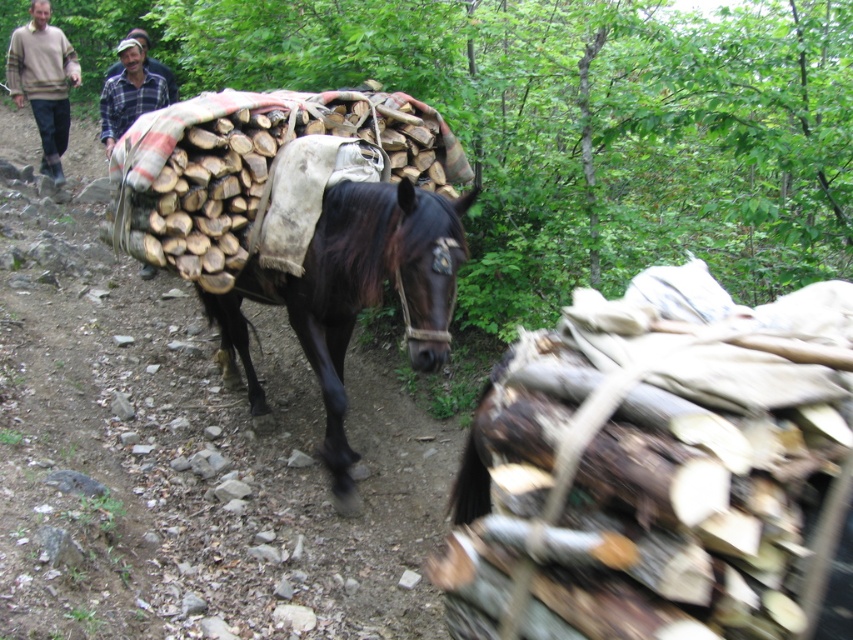
In the scene shown: Can you confirm if shiny dark brown horse at center is positioned below beige sweater at upper left?

Correct, shiny dark brown horse at center is located below beige sweater at upper left.

Does shiny dark brown horse at center have a lesser height compared to beige sweater at upper left?

Indeed, shiny dark brown horse at center has a lesser height compared to beige sweater at upper left.

Is point (338, 506) closer to camera compared to point (67, 44)?

Yes, it is in front of point (67, 44).

Locate an element on the screen. The image size is (853, 640). shiny dark brown horse at center is located at coordinates (349, 291).

Can you confirm if wooden logs at center is positioned to the left of beige sweater at upper left?

In fact, wooden logs at center is to the right of beige sweater at upper left.

Is wooden logs at center bigger than beige sweater at upper left?

No.

Who is more distant from viewer, [421,134] or [51,80]?

The point [51,80] is more distant.

Find the location of a particular element. The width and height of the screenshot is (853, 640). wooden logs at center is located at coordinates (260, 173).

Consider the image. Measure the distance between point (x=331, y=113) and camera.

They are 4.16 meters apart.

Who is taller, wooden logs at center or shiny dark brown horse at center?

Standing taller between the two is shiny dark brown horse at center.

Who is more distant from viewer, (x=229, y=240) or (x=427, y=266)?

Point (x=229, y=240)

Image resolution: width=853 pixels, height=640 pixels. Find the location of `wooden logs at center`. wooden logs at center is located at coordinates (260, 173).